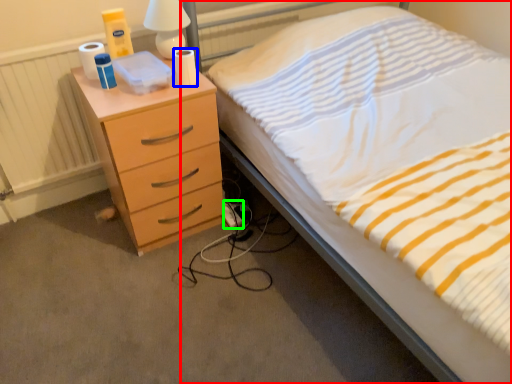
Question: Estimate the real-world distances between objects in this image. Which object is farther from bed (highlighted by a red box), toilet paper (highlighted by a blue box) or extension cord (highlighted by a green box)?

Choices:
 (A) toilet paper
 (B) extension cord

Answer: (B)